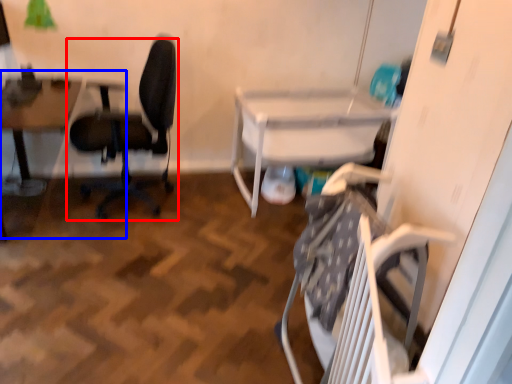
Question: Which object is further to the camera taking this photo, chair (highlighted by a red box) or table (highlighted by a blue box)?

Choices:
 (A) chair
 (B) table

Answer: (B)